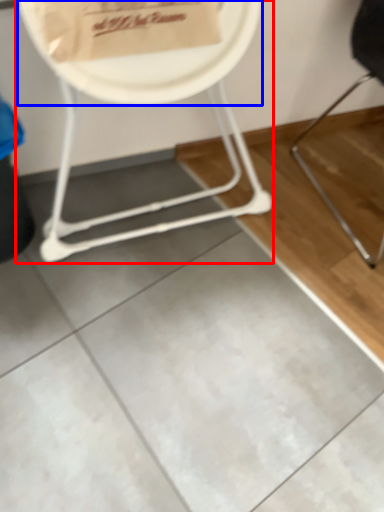
Question: Among these objects, which one is farthest to the camera, chair (highlighted by a red box) or paper plate (highlighted by a blue box)?

Choices:
 (A) chair
 (B) paper plate

Answer: (B)